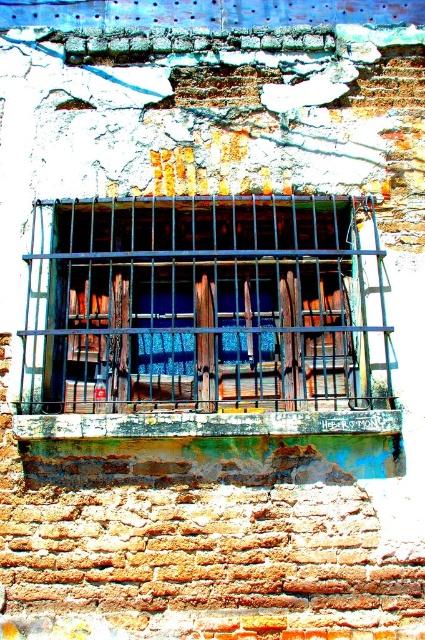
Who is taller, metallic bars at center or rusty metal window sill at center?

metallic bars at center is taller.

Is metallic bars at center closer to the viewer compared to rusty metal window sill at center?

That is False.

I want to click on metallic bars at center, so click(204, 305).

Identify the location of metallic bars at center. Image resolution: width=425 pixels, height=640 pixels. (204, 305).